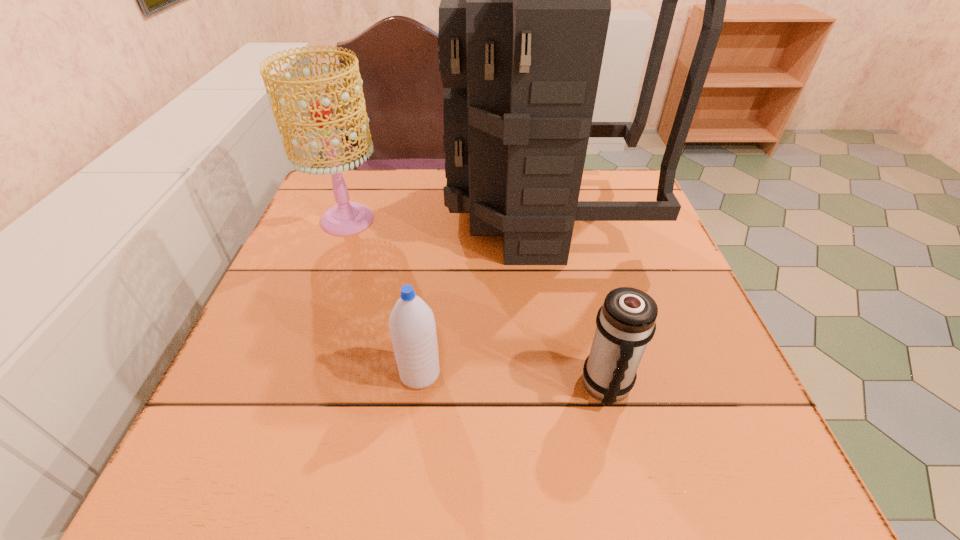
Locate an element on the screen. The width and height of the screenshot is (960, 540). vacant space at the right edge is located at coordinates (744, 428).

Image resolution: width=960 pixels, height=540 pixels. What are the coordinates of `free space at the near left corner of the desktop` in the screenshot? It's located at (257, 480).

The width and height of the screenshot is (960, 540). In order to click on free space at the far right corner of the desktop in this screenshot , I will do `click(584, 174)`.

The width and height of the screenshot is (960, 540). Identify the location of unoccupied area between the thermos bottle and the water bottle. (514, 380).

Locate an element on the screen. vacant space in between the lampshade and the water bottle is located at coordinates [x=384, y=296].

The width and height of the screenshot is (960, 540). Identify the location of free area in between the water bottle and the leftmost object. point(384,296).

The width and height of the screenshot is (960, 540). I want to click on vacant space that is in between the water bottle and the backpack, so click(482, 293).

Identify the location of free spot between the leftmost object and the thermos bottle. Image resolution: width=960 pixels, height=540 pixels. (477, 303).

Locate an element on the screen. This screenshot has width=960, height=540. vacant space in between the backpack and the thermos bottle is located at coordinates (575, 300).

Where is `free space between the water bottle and the lampshade`? free space between the water bottle and the lampshade is located at coordinates (384, 296).